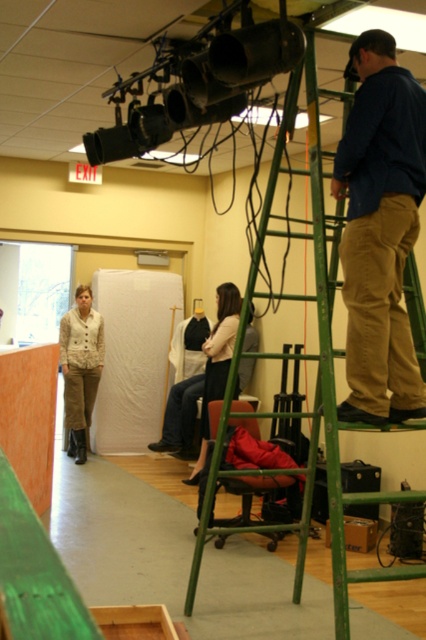
You are a photographer setting up for a shoot. You need to position your matte black video camera at upper center so that it can capture the entire scene without obstruction. Considering the green metal ladder at upper right, will the camera be able to see past it?

The matte black video camera at upper center is not as tall as the green metal ladder at upper right, so it may not be able to see past the ladder without obstruction.

Looking at this image, you are a photographer setting up for a shoot. You notice the dark blue cotton shirt at upper right and the matte black video camera at upper center. Which object is located below the other?

The dark blue cotton shirt at upper right is positioned under the matte black video camera at upper center, so the shirt is below the camera.